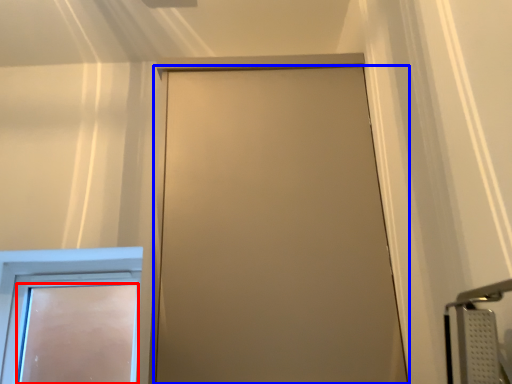
Question: Which of the following is the farthest to the observer, door (highlighted by a red box) or door (highlighted by a blue box)?

Choices:
 (A) door
 (B) door

Answer: (A)